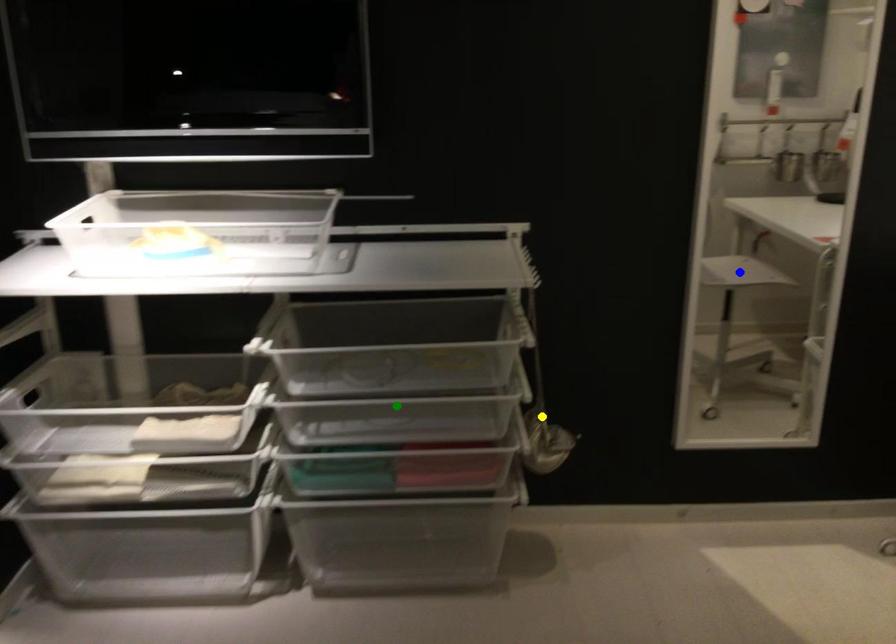
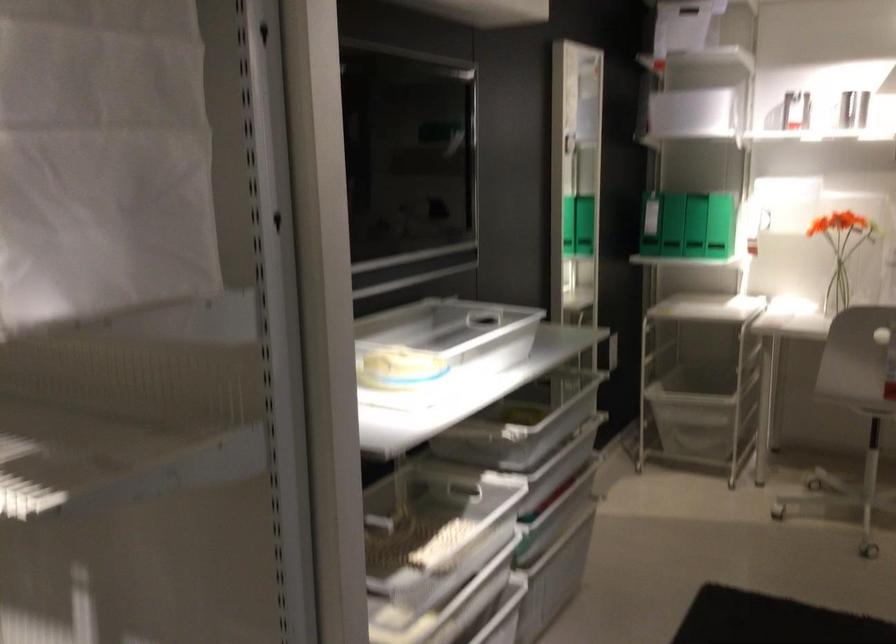
I am providing you with two images of the same scene from different viewpoints. Three points are marked in image1. Which point corresponds to a part or object that is occluded in image2?In image1, three points are marked. Which of them correspond to a part or object that is occluded in image2?Among the three points shown in image1, which one corresponds to a part or object that is no longer visible due to occlusion in image2?

green point, blue point, yellow point cannot be seen in image2.